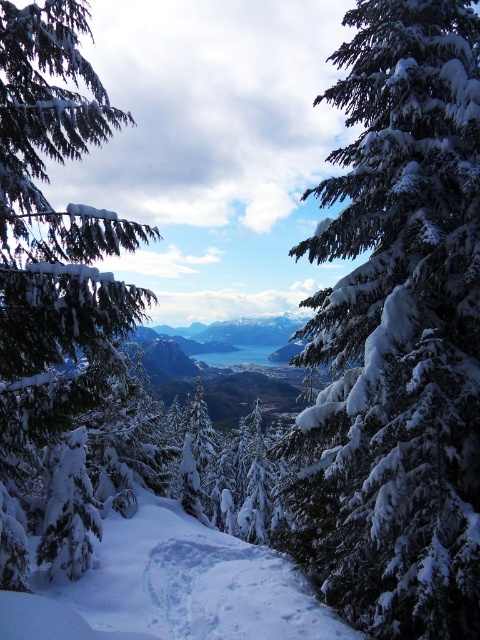
Question: Considering the relative positions of snow-covered evergreen at center and white snow-covered tree at left in the image provided, where is snow-covered evergreen at center located with respect to white snow-covered tree at left?

Choices:
 (A) right
 (B) left

Answer: (A)

Question: Which point is closer to the camera?

Choices:
 (A) white snow-covered tree at left
 (B) snow-covered evergreen at center

Answer: (A)

Question: Can you confirm if white snow-covered tree at left is positioned to the left of white fluffy snow at center?

Choices:
 (A) no
 (B) yes

Answer: (B)

Question: Which point is closer to the camera taking this photo?

Choices:
 (A) (142, 636)
 (B) (307, 468)
 (C) (23, 225)

Answer: (A)

Question: Which object is farther from the camera taking this photo?

Choices:
 (A) white fluffy snow at center
 (B) snow-covered evergreen at center

Answer: (B)

Question: Does snow-covered evergreen at center lie behind white snow-covered tree at left?

Choices:
 (A) no
 (B) yes

Answer: (B)